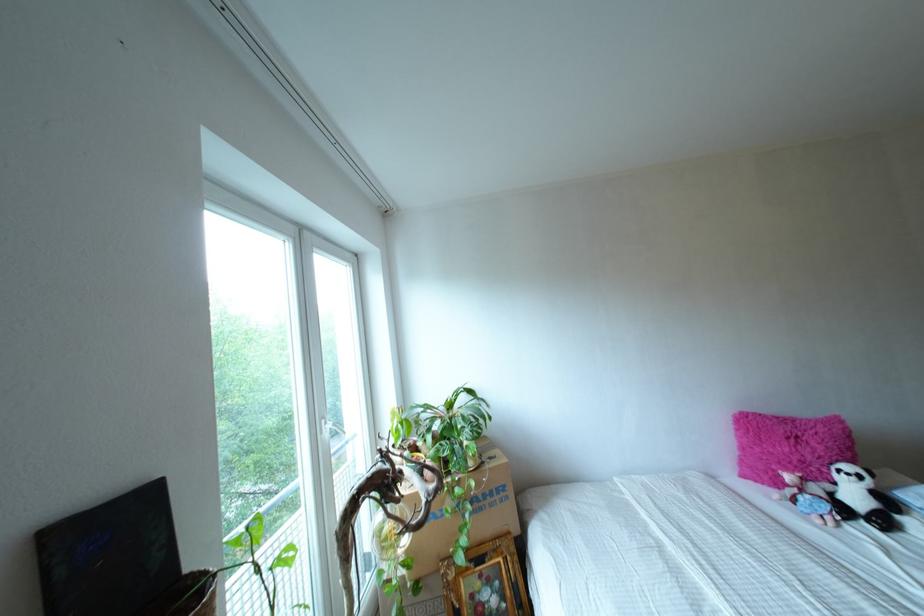
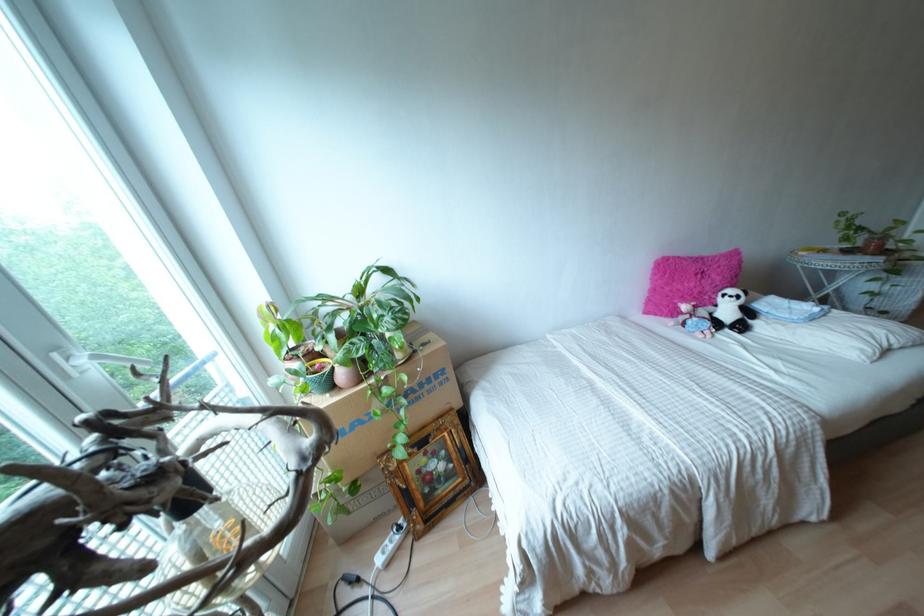
Find the pixel in the second image that matches point 490,493 in the first image.

(428, 379)